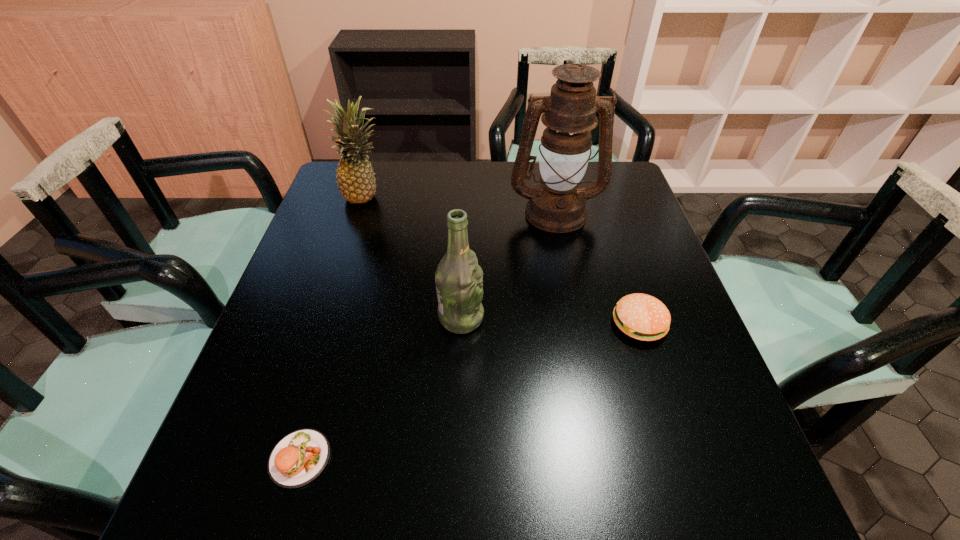
This screenshot has width=960, height=540. What are the coordinates of `free space between the pineapple and the tallest object` in the screenshot? It's located at (461, 204).

Locate an element on the screen. The image size is (960, 540). unoccupied position between the pineapple and the fourth tallest object is located at coordinates (502, 260).

Where is `empty space between the nearer patty and the oil lamp`? The width and height of the screenshot is (960, 540). empty space between the nearer patty and the oil lamp is located at coordinates (427, 335).

The image size is (960, 540). What are the coordinates of `free space between the fourth tallest object and the nearer patty` in the screenshot? It's located at (469, 392).

Locate an element on the screen. vacant area between the pineapple and the third object from left to right is located at coordinates (414, 257).

This screenshot has width=960, height=540. Find the location of `unoccupied area between the third object from right to left and the right patty`. unoccupied area between the third object from right to left and the right patty is located at coordinates (550, 321).

I want to click on free space between the tallest object and the beer bottle, so click(508, 265).

Image resolution: width=960 pixels, height=540 pixels. In order to click on object that stands as the closest to the third object from left to right in this screenshot , I will do `click(557, 205)`.

Select which object is the second closest to the nearest object. Please provide its 2D coordinates. Your answer should be formatted as a tuple, i.e. [(x, y)], where the tuple contains the x and y coordinates of a point satisfying the conditions above.

[(643, 317)]

You are a GUI agent. You are given a task and a screenshot of the screen. Output one action in this format:
    pyautogui.click(x=<x>, y=<y>)
    Task: Click on the free space that satisfies the following two spatial constraints: 1. on the front side of the oil lamp; 2. on the surface of the third object from left to right
    
    Given the screenshot: What is the action you would take?
    pyautogui.click(x=577, y=318)